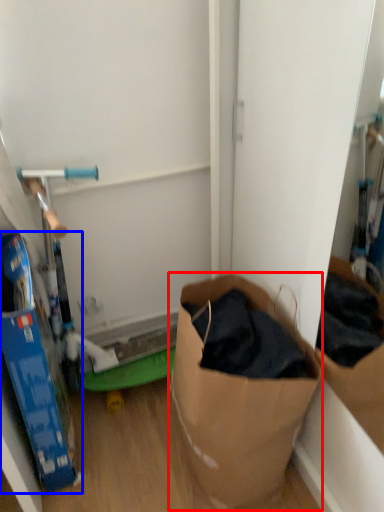
Question: Among these objects, which one is farthest to the camera, paper bag (highlighted by a red box) or box (highlighted by a blue box)?

Choices:
 (A) paper bag
 (B) box

Answer: (A)